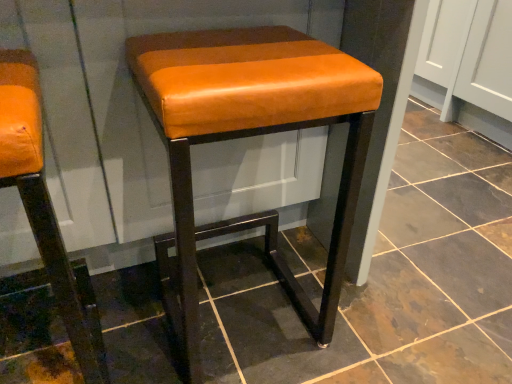
You are a GUI agent. You are given a task and a screenshot of the screen. Output one action in this format:
    pyautogui.click(x=<x>, y=<y>)
    Task: Click on the vacant region to the right of matte orange leather stool at center, marked as the first stool in a right-to-left arrangement
    The height and width of the screenshot is (384, 512).
    Given the screenshot: What is the action you would take?
    (x=376, y=316)